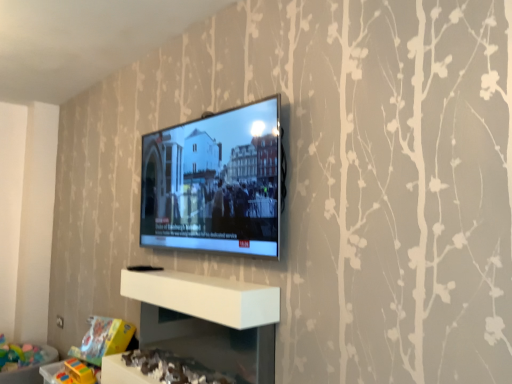
Question: Is white glossy shelf at lower center, the second shelf positioned from the top, facing away from white matte shelf at center, which is the second shelf from bottom to top?

Choices:
 (A) no
 (B) yes

Answer: (A)

Question: Does white glossy shelf at lower center, placed as the 1th shelf when sorted from bottom to top, have a lesser height compared to white matte shelf at center, the 1th shelf from the top?

Choices:
 (A) yes
 (B) no

Answer: (B)

Question: Is white glossy shelf at lower center, the second shelf positioned from the top, at the right side of white matte shelf at center, the 1th shelf from the top?

Choices:
 (A) yes
 (B) no

Answer: (B)

Question: Does white glossy shelf at lower center, placed as the 1th shelf when sorted from bottom to top, have a lesser width compared to white matte shelf at center, which is the second shelf from bottom to top?

Choices:
 (A) no
 (B) yes

Answer: (A)

Question: From a real-world perspective, is white glossy shelf at lower center, the second shelf positioned from the top, physically above white matte shelf at center, which is the second shelf from bottom to top?

Choices:
 (A) no
 (B) yes

Answer: (A)

Question: From the image's perspective, is white glossy shelf at lower center, placed as the 1th shelf when sorted from bottom to top, located above or below white matte shelf at center, the 1th shelf from the top?

Choices:
 (A) below
 (B) above

Answer: (A)

Question: Is white glossy shelf at lower center, the second shelf positioned from the top, wider or thinner than white matte shelf at center, which is the second shelf from bottom to top?

Choices:
 (A) wide
 (B) thin

Answer: (A)

Question: Considering the positions of white glossy shelf at lower center, the second shelf positioned from the top, and white matte shelf at center, the 1th shelf from the top, in the image, is white glossy shelf at lower center, the second shelf positioned from the top, taller or shorter than white matte shelf at center, the 1th shelf from the top,?

Choices:
 (A) short
 (B) tall

Answer: (B)

Question: Relative to white matte shelf at center, the 1th shelf from the top, is white glossy shelf at lower center, the second shelf positioned from the top, in front or behind?

Choices:
 (A) front
 (B) behind

Answer: (A)

Question: In terms of height, does white glossy shelf at lower center, placed as the 1th shelf when sorted from bottom to top, look taller or shorter compared to matte black tv at center?

Choices:
 (A) tall
 (B) short

Answer: (B)

Question: Looking at their shapes, would you say white glossy shelf at lower center, the second shelf positioned from the top, is wider or thinner than matte black tv at center?

Choices:
 (A) wide
 (B) thin

Answer: (A)

Question: From a real-world perspective, relative to matte black tv at center, is white glossy shelf at lower center, the second shelf positioned from the top, vertically above or below?

Choices:
 (A) below
 (B) above

Answer: (A)

Question: From the image's perspective, is white glossy shelf at lower center, the second shelf positioned from the top, above or below matte black tv at center?

Choices:
 (A) above
 (B) below

Answer: (B)

Question: Is white matte shelf at center, which is the second shelf from bottom to top, inside or outside of white glossy shelf at lower center, placed as the 1th shelf when sorted from bottom to top?

Choices:
 (A) outside
 (B) inside

Answer: (A)

Question: Considering the positions of white matte shelf at center, which is the second shelf from bottom to top, and white glossy shelf at lower center, placed as the 1th shelf when sorted from bottom to top, in the image, is white matte shelf at center, which is the second shelf from bottom to top, wider or thinner than white glossy shelf at lower center, placed as the 1th shelf when sorted from bottom to top,?

Choices:
 (A) thin
 (B) wide

Answer: (A)